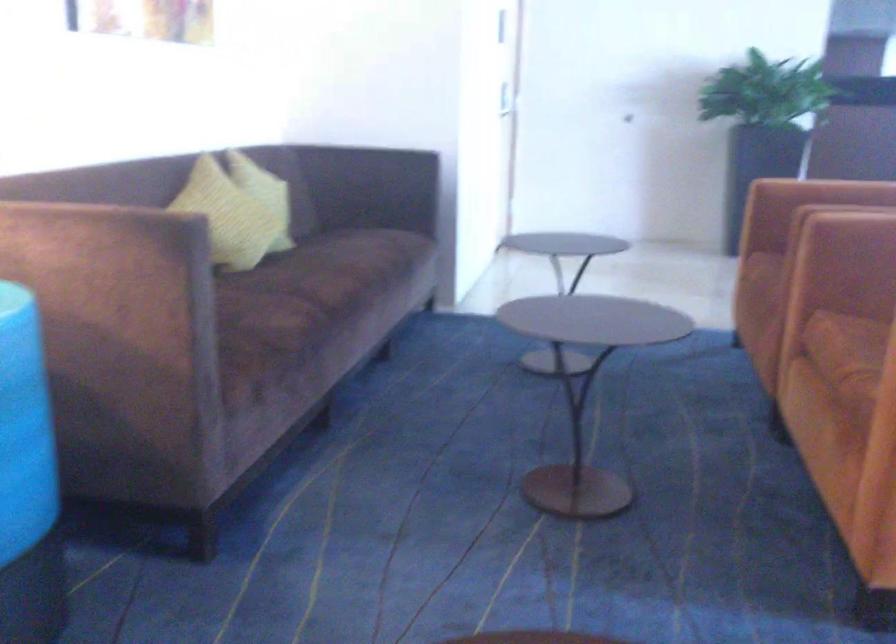
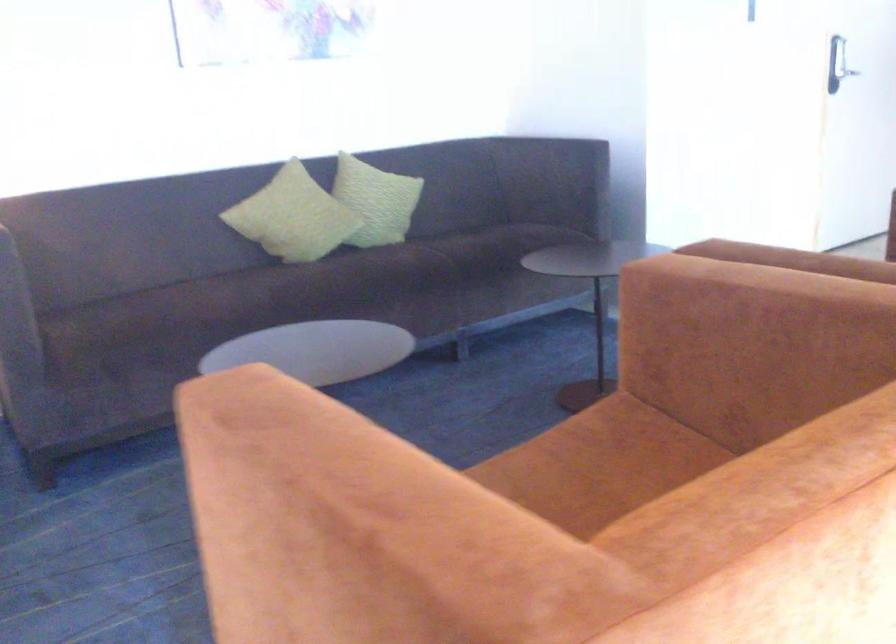
Locate, in the second image, the point that corresponds to [254,219] in the first image.

(293, 216)